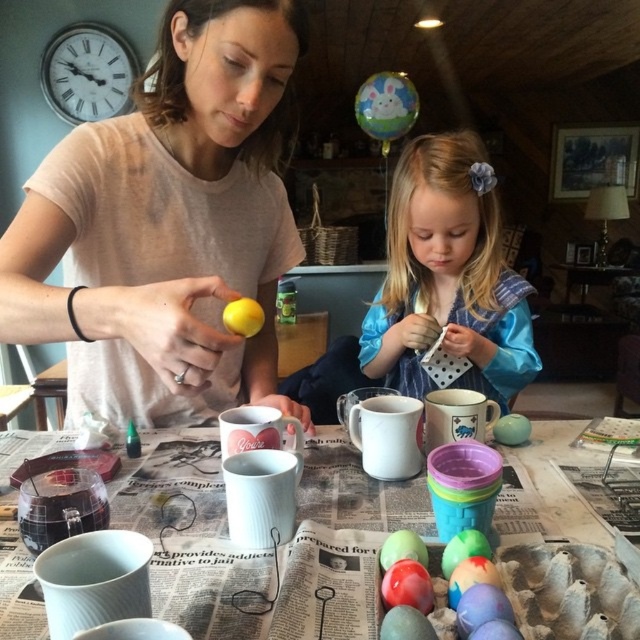
You are setting up a craft station for an Easter egg decorating event. You have a matte ceramic cups at center and a matte pastel egg at lower center on the table. Which object would be more suitable to hold a brush temporarily?

The matte ceramic cups at center has a larger size compared to the matte pastel egg at lower center, so it would be more suitable to hold a brush temporarily.